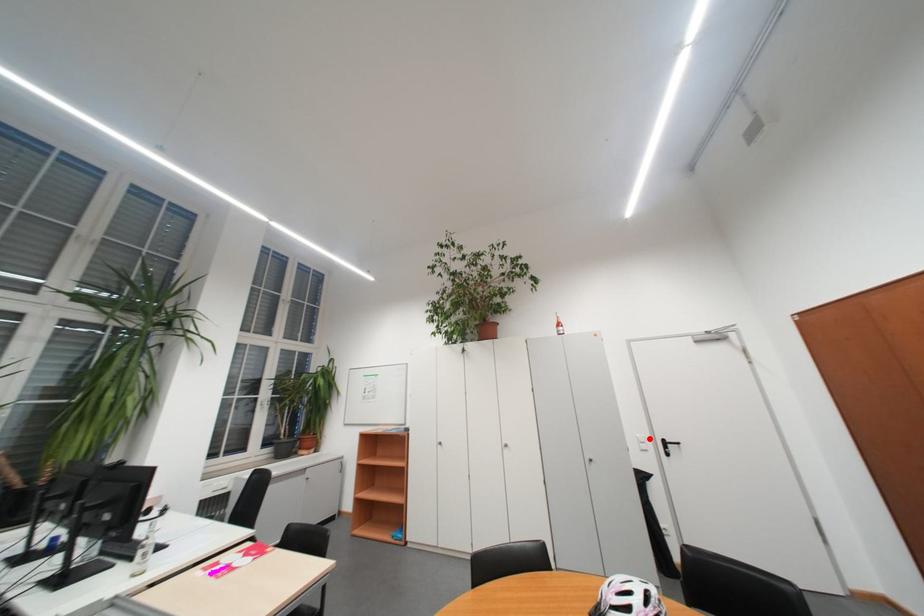
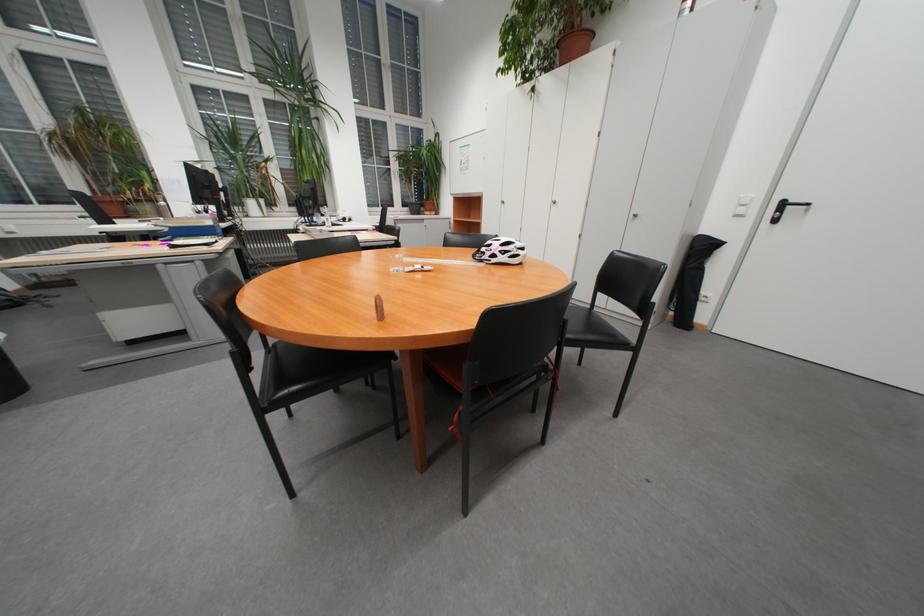
Where in the second image is the point corresponding to the highlighted location from the first image?

(751, 199)